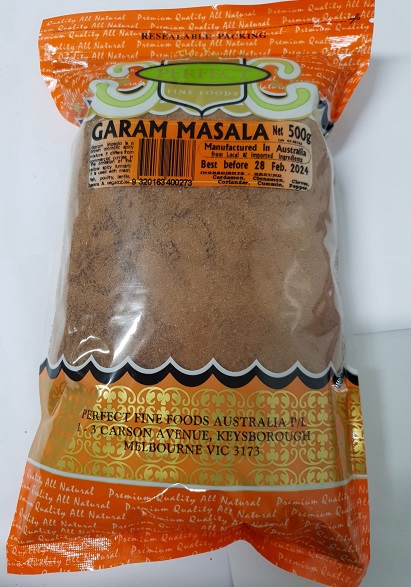
Identify the location of white surface. (363, 178).